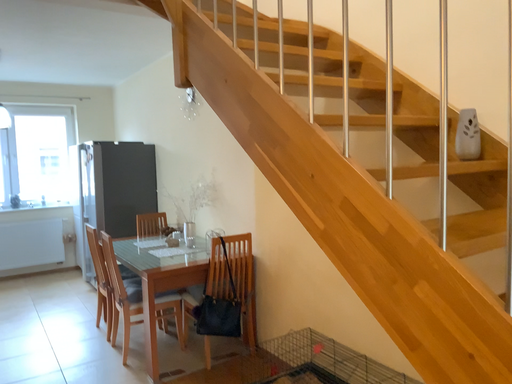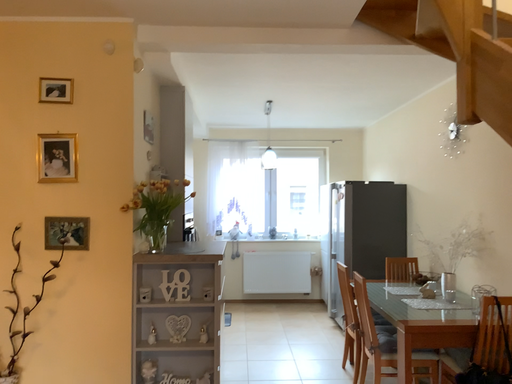
Question: Which way did the camera rotate in the video?

Choices:
 (A) rotated downward
 (B) rotated upward

Answer: (B)